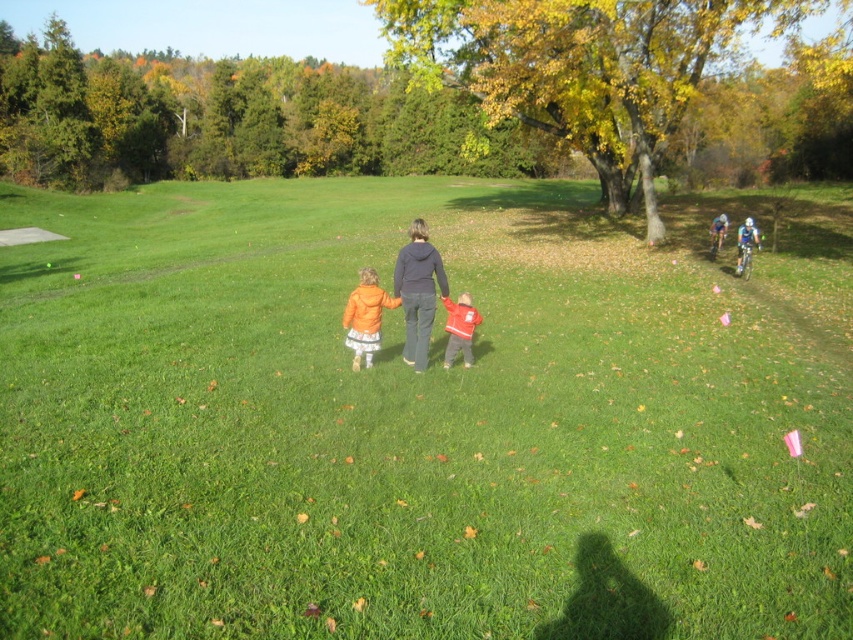
You are standing at point (757,237) and want to walk to point (357,337). Is there any obstacle between you and your destination?

Point (357,337) is in front of point (757,237), so there is no obstacle between them.

In the scene shown: You are a photographer trying to capture a photo of the red fleece jacket at center and the blue fabric cyclist at right. Which object should you focus on first if you want to ensure both are in focus without adjusting your camera settings?

The red fleece jacket at center has a lesser height compared to blue fabric cyclist at right, so you should focus on the blue fabric cyclist at right first to ensure both are in focus.